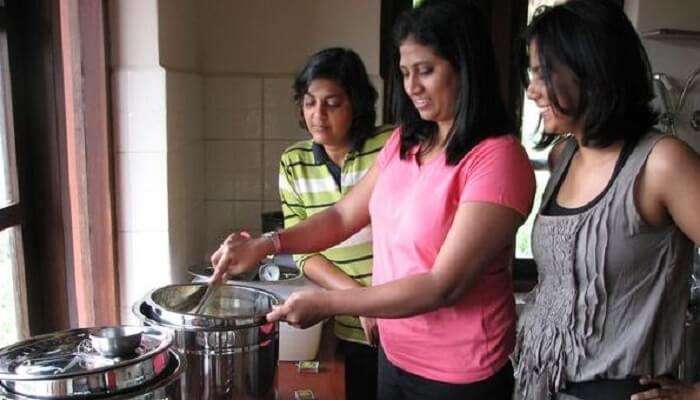
Locate an element on the screen. This screenshot has width=700, height=400. bowls is located at coordinates (120, 344), (180, 308).